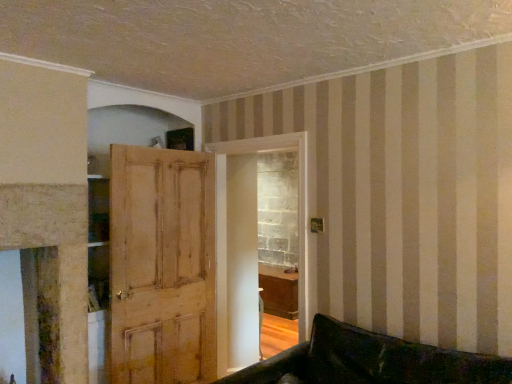
Question: Should I look upward or downward to see light brown wooden door at center?

Choices:
 (A) down
 (B) up

Answer: (A)